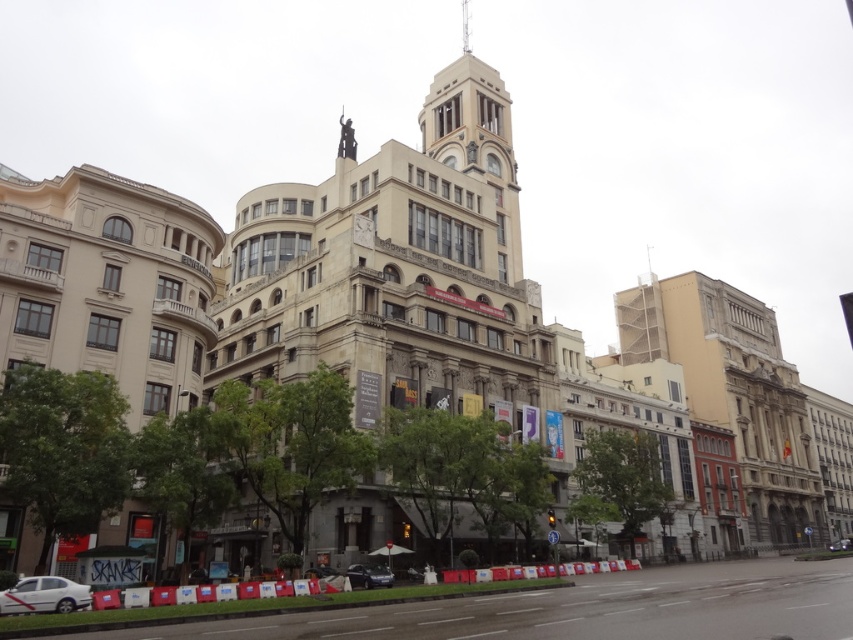
Does smooth concrete spire at center have a larger size compared to shiny silver car at center?

Yes, smooth concrete spire at center is bigger than shiny silver car at center.

Is smooth concrete spire at center smaller than shiny silver car at center?

Incorrect, smooth concrete spire at center is not smaller in size than shiny silver car at center.

The width and height of the screenshot is (853, 640). What are the coordinates of `smooth concrete spire at center` in the screenshot? It's located at (465, 26).

Does stone tower at center appear on the right side of white matte car at lower left?

A: Correct, you'll find stone tower at center to the right of white matte car at lower left.

Image resolution: width=853 pixels, height=640 pixels. I want to click on stone tower at center, so click(x=398, y=273).

Between point (445, 228) and point (32, 577), which one is positioned in front?

Point (32, 577) is in front.

Identify the location of stone tower at center. The image size is (853, 640). (398, 273).

Between stone tower at center and smooth concrete spire at center, which one is positioned lower?

stone tower at center is below.

Between point (370, 205) and point (463, 32), which one is positioned in front?

Point (370, 205)

The image size is (853, 640). I want to click on stone tower at center, so click(x=398, y=273).